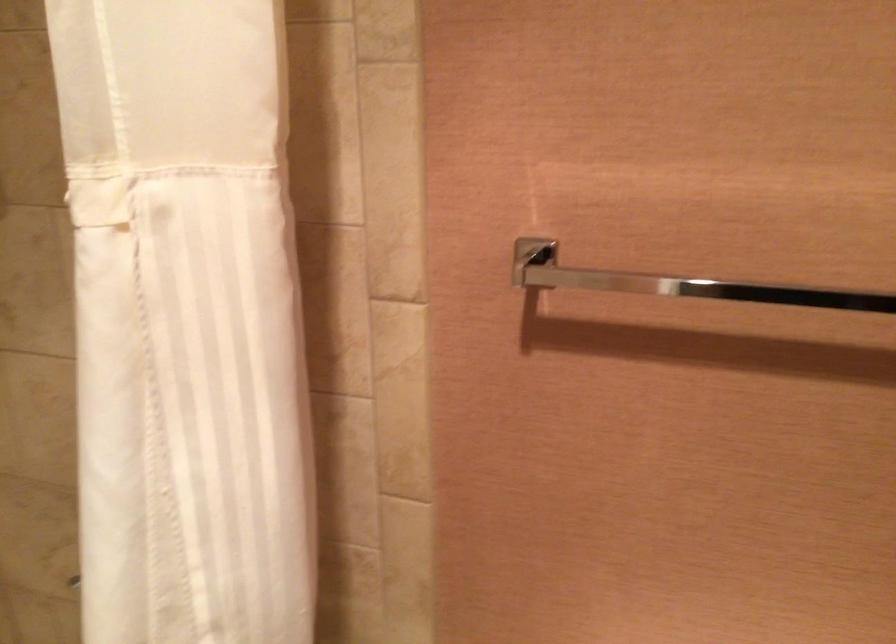
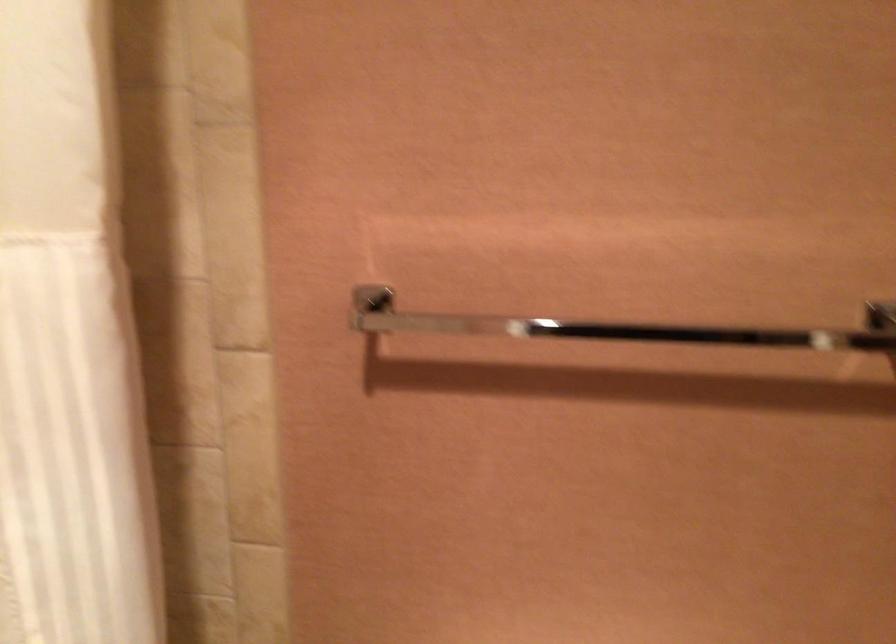
Question: The images are taken continuously from a first-person perspective. In which direction is your viewpoint rotating?

Choices:
 (A) Left
 (B) Right
 (C) Up
 (D) Down

Answer: (B)